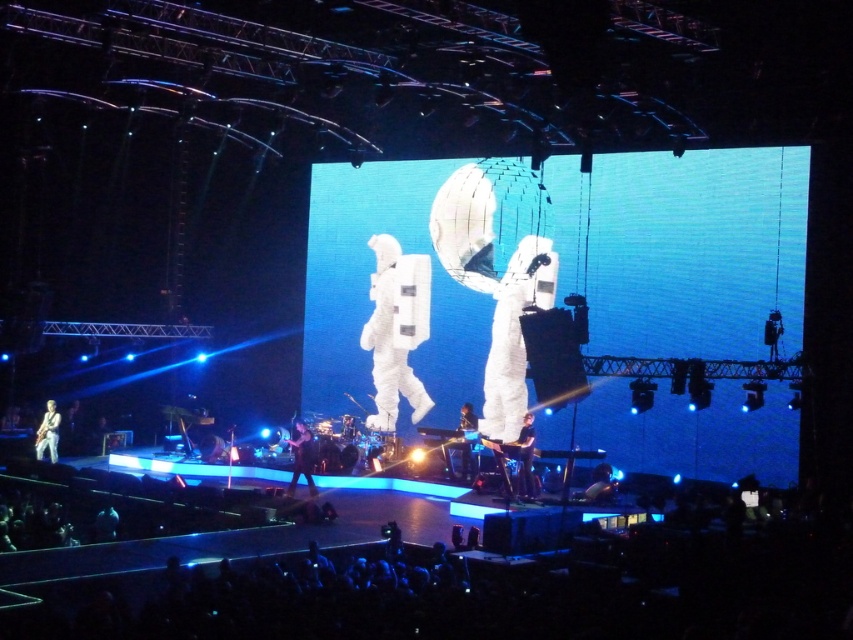
You are a photographer at the concert trying to capture a clear shot of the shiny metallic helmet at lower center and the black leather pants at lower center. Which object should you focus on first if you want to capture both in the same frame without moving the camera?

The black leather pants at lower center is positioned on the left side of the shiny metallic helmet at lower center. Since they are both at lower center, focusing on the black leather pants at lower center first would allow you to frame both objects together as they are adjacent to each other.

You are at the concert and want to take a photo of the black leather pants at lower center. The venue has a rule that photos can only be taken if the subject is within the central 30x30 cm area of the frame. Given that the point representing the black leather pants at lower center is at coordinate point (526, 458), will you be able to take the photo?

The black leather pants at lower center is represented by point (526, 458). Since the central 30x30 cm area requires the subject to be within the center coordinates, this point is outside the central area, so you cannot take the photo.

You are a photographer at the concert and want to capture a photo that includes both the black leather jacket at center and the light brown leather guitar at lower left. Based on their positions, which object should you place on the right side of your photo frame?

The black leather jacket at center should be placed on the right side of your photo frame since it is to the right of the light brown leather guitar at lower left.